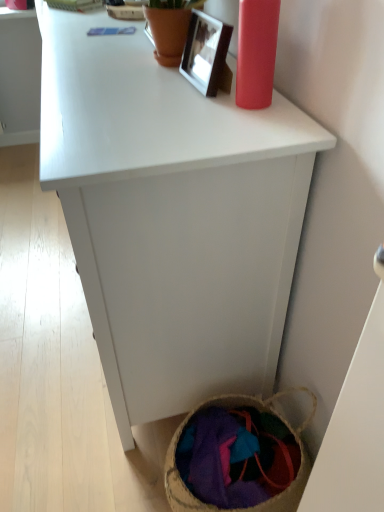
Question: Is white matte cabinet at center in front of or behind metallic silver picture frame at upper center in the image?

Choices:
 (A) front
 (B) behind

Answer: (A)

Question: Is white matte cabinet at center bigger or smaller than metallic silver picture frame at upper center?

Choices:
 (A) small
 (B) big

Answer: (B)

Question: Which is nearer to the white matte cabinet at center?

Choices:
 (A) metallic silver picture frame at upper center
 (B) textured woven basket at lower right

Answer: (A)

Question: Considering the real-world distances, which object is closest to the white matte cabinet at center?

Choices:
 (A) metallic silver picture frame at upper center
 (B) textured woven basket at lower right

Answer: (A)